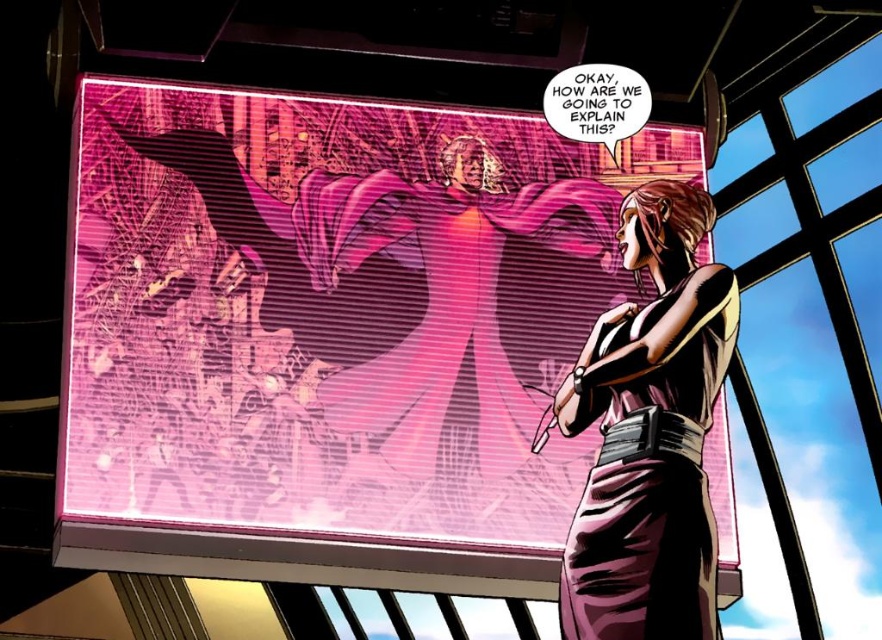
Based on the scene description, where exactly is the smooth purple pants at center located in terms of coordinates?

The smooth purple pants at center is located at point coordinates of (x=331, y=333).

You are a photographer trying to capture the character in the comic book scene. You want to ensure that the point at coordinates point [380,220] is in focus. Given that your camera has a depth of field that can sharply capture objects within 25 meters of the camera, will this point be in focus?

The point at coordinates point [380,220] is 28.67 meters away from the camera, which is beyond the 25 meters depth of field range. Therefore, this point will not be in focus.